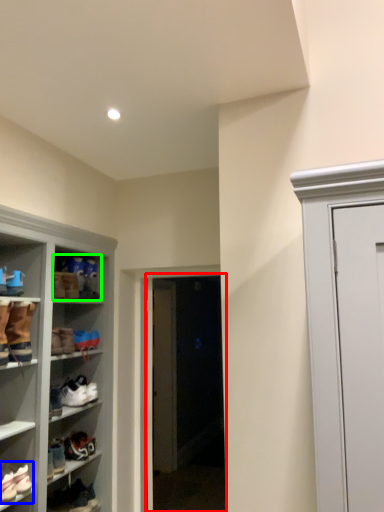
Question: Based on their relative distances, which object is farther from glass door (highlighted by a red box)? Choose from footwear (highlighted by a blue box) and footwear (highlighted by a green box).

Choices:
 (A) footwear
 (B) footwear

Answer: (A)